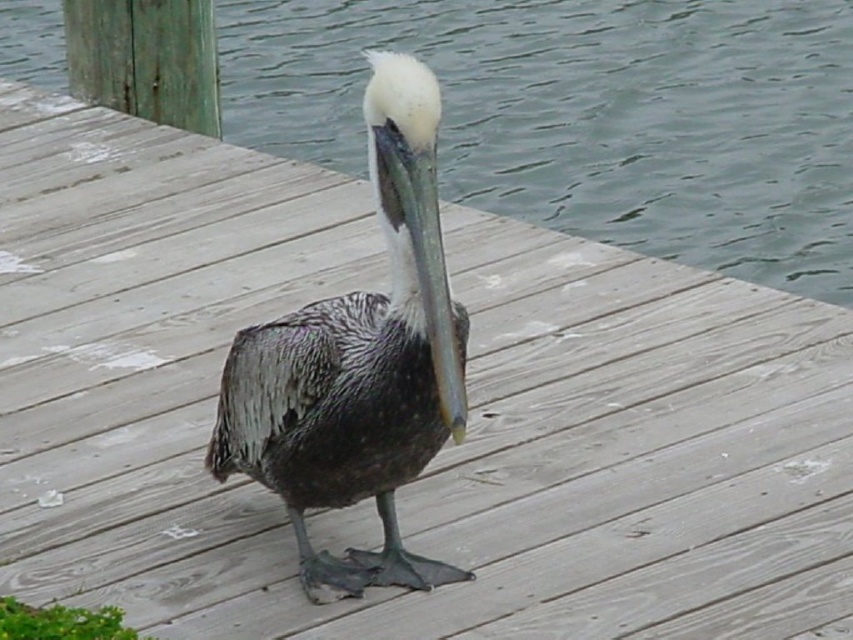
Who is shorter, clear water at center or speckled feathered pelican at center?

speckled feathered pelican at center is shorter.

In the scene shown: Can you confirm if clear water at center is positioned to the left of speckled feathered pelican at center?

In fact, clear water at center is to the right of speckled feathered pelican at center.

Identify the location of clear water at center. (589, 115).

Image resolution: width=853 pixels, height=640 pixels. I want to click on clear water at center, so click(589, 115).